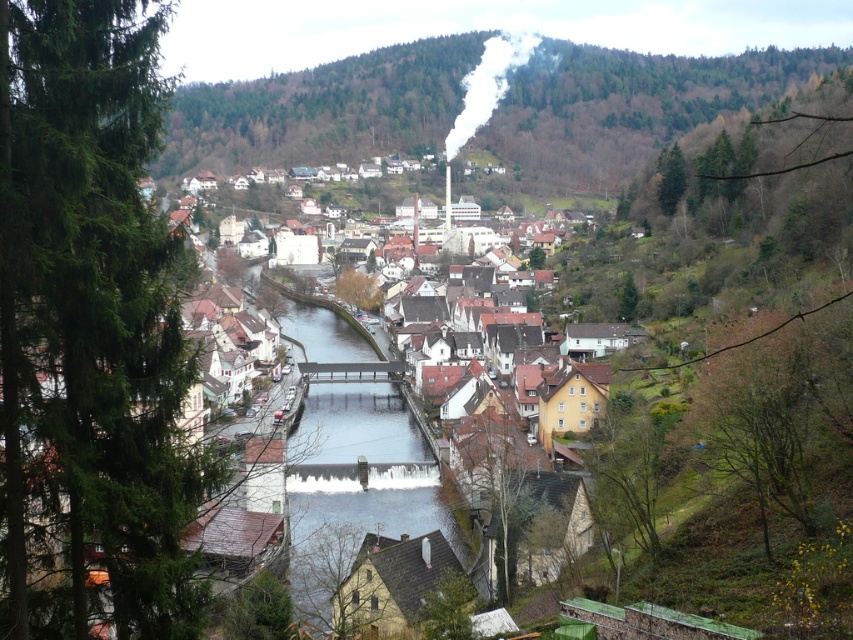
You are a hiker planning to take a photo of the town from a higher elevation. The green forested hillside at upper center is your only option for elevation. Can you confirm if this hillside is positioned above the town to provide a clear view?

The green forested hillside at upper center is located at point (627, 104), which places it above the town, offering a clear elevated view for photography.

You are a tourist standing at the edge of the river in the town. You see the smooth concrete bridge at center and the white smoke at upper center. Which object is closer to your right side?

The white smoke at upper center is closer to your right side because the smooth concrete bridge at center is to the left of it.

You are a tourist standing at the edge of the town, looking towards the river. You notice the green forested hillside at upper center and the smooth concrete bridge at center. Which of these two landmarks is positioned to the right from your viewpoint?

The green forested hillside at upper center is to the right of the smooth concrete bridge at center, so the green forested hillside at upper center is positioned to the right from your viewpoint.